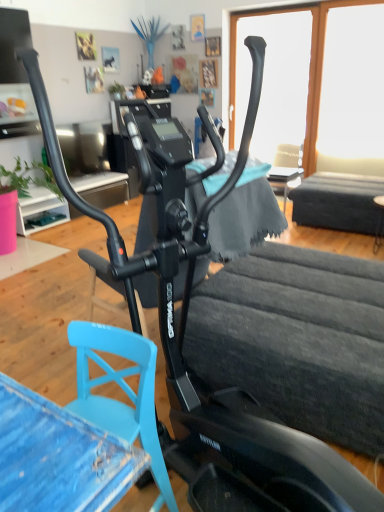
Describe the element at coordinates (352, 92) in the screenshot. I see `transparent glass window at upper right, which is the first window screen in right-to-left order` at that location.

At what (x,y) coordinates should I click in order to perform the action: click on transparent glass window at upper right, the second window screen viewed from the left. Please return your answer as a coordinate pair (x, y). The height and width of the screenshot is (512, 384). Looking at the image, I should click on (352, 92).

You are a GUI agent. You are given a task and a screenshot of the screen. Output one action in this format:
    pyautogui.click(x=<x>, y=<y>)
    Task: Click on the blue painted wood swivel chair at lower left
    
    Given the screenshot: What is the action you would take?
    pyautogui.click(x=124, y=391)

Describe the element at coordinates (337, 202) in the screenshot. I see `smooth wooden table at right, the 1th table when ordered from back to front` at that location.

Based on the photo, in order to face smooth wooden table at right, positioned as the 2th table in front-to-back order, should I rotate leftwards or rightwards?

Turn right approximately 20.740 degrees to face it.

This screenshot has height=512, width=384. I want to click on black matte table at lower right, which is counted as the 1th table, starting from the front, so click(x=378, y=222).

The image size is (384, 512). Describe the element at coordinates (309, 65) in the screenshot. I see `transparent glass window at upper center, arranged as the 2th window screen when viewed from the right` at that location.

The width and height of the screenshot is (384, 512). In order to click on transparent glass window at upper right, the second window screen viewed from the left in this screenshot , I will do `click(352, 92)`.

Would you say transparent glass window at upper right, the second window screen viewed from the left, is inside or outside black matte table at lower right, which is counted as the 1th table, starting from the front?

transparent glass window at upper right, the second window screen viewed from the left, exists outside the volume of black matte table at lower right, which is counted as the 1th table, starting from the front.

Is transparent glass window at upper right, which is the first window screen in right-to-left order, not near black matte table at lower right, the second table from the back?

Yes, transparent glass window at upper right, which is the first window screen in right-to-left order, and black matte table at lower right, the second table from the back, are quite far apart.

Could you tell me if transparent glass window at upper right, which is the first window screen in right-to-left order, is facing black matte table at lower right, which is counted as the 1th table, starting from the front?

Yes, transparent glass window at upper right, which is the first window screen in right-to-left order, is turned towards black matte table at lower right, which is counted as the 1th table, starting from the front.

Could you measure the distance between transparent glass window at upper right, which is the first window screen in right-to-left order, and black matte table at lower right, which is counted as the 1th table, starting from the front?

A distance of 1.27 meters exists between transparent glass window at upper right, which is the first window screen in right-to-left order, and black matte table at lower right, which is counted as the 1th table, starting from the front.

Are transparent glass window at upper center, which appears as the first window screen when viewed from the left, and transparent glass window at upper right, the second window screen viewed from the left, beside each other?

transparent glass window at upper center, which appears as the first window screen when viewed from the left, and transparent glass window at upper right, the second window screen viewed from the left, are not in contact.

Is transparent glass window at upper center, which appears as the first window screen when viewed from the left, facing away from transparent glass window at upper right, which is the first window screen in right-to-left order?

No, transparent glass window at upper center, which appears as the first window screen when viewed from the left,'s orientation is not away from transparent glass window at upper right, which is the first window screen in right-to-left order.

Considering the sizes of objects transparent glass window at upper center, which appears as the first window screen when viewed from the left, and transparent glass window at upper right, which is the first window screen in right-to-left order, in the image provided, who is wider, transparent glass window at upper center, which appears as the first window screen when viewed from the left, or transparent glass window at upper right, which is the first window screen in right-to-left order,?

transparent glass window at upper right, which is the first window screen in right-to-left order.

Considering the relative sizes of transparent glass window at upper center, arranged as the 2th window screen when viewed from the right, and transparent glass window at upper right, which is the first window screen in right-to-left order, in the image provided, is transparent glass window at upper center, arranged as the 2th window screen when viewed from the right, smaller than transparent glass window at upper right, which is the first window screen in right-to-left order,?

No, transparent glass window at upper center, arranged as the 2th window screen when viewed from the right, is not smaller than transparent glass window at upper right, which is the first window screen in right-to-left order.

Locate an element on the screen. fabric in front of the transparent glass window at upper right, which is the first window screen in right-to-left order is located at coordinates (245, 215).

Which object is wider, soft blue cloth at center or transparent glass window at upper right, the second window screen viewed from the left?

With larger width is soft blue cloth at center.

Do you think soft blue cloth at center is within transparent glass window at upper right, the second window screen viewed from the left, or outside of it?

soft blue cloth at center is not inside transparent glass window at upper right, the second window screen viewed from the left, it's outside.

Can you confirm if soft blue cloth at center is bigger than transparent glass window at upper right, which is the first window screen in right-to-left order?

No, soft blue cloth at center is not bigger than transparent glass window at upper right, which is the first window screen in right-to-left order.

Can you see blue painted wood swivel chair at lower left touching smooth wooden table at right, positioned as the 2th table in front-to-back order?

There is a gap between blue painted wood swivel chair at lower left and smooth wooden table at right, positioned as the 2th table in front-to-back order.

Looking at this image, is blue painted wood swivel chair at lower left inside or outside of smooth wooden table at right, positioned as the 2th table in front-to-back order?

blue painted wood swivel chair at lower left is not inside smooth wooden table at right, positioned as the 2th table in front-to-back order, it's outside.

Which of these two, blue painted wood swivel chair at lower left or smooth wooden table at right, positioned as the 2th table in front-to-back order, is thinner?

blue painted wood swivel chair at lower left.

Is transparent glass window at upper right, the second window screen viewed from the left, situated inside transparent glass window at upper center, which appears as the first window screen when viewed from the left, or outside?

transparent glass window at upper right, the second window screen viewed from the left, is not enclosed by transparent glass window at upper center, which appears as the first window screen when viewed from the left.

Is transparent glass window at upper right, the second window screen viewed from the left, further to the viewer compared to transparent glass window at upper center, which appears as the first window screen when viewed from the left?

No, transparent glass window at upper right, the second window screen viewed from the left, is in front of transparent glass window at upper center, which appears as the first window screen when viewed from the left.

This screenshot has width=384, height=512. In the image, there is a transparent glass window at upper right, the second window screen viewed from the left. Find the location of `window screen below it (from a real-world perspective)`. window screen below it (from a real-world perspective) is located at coordinates (309, 65).

Does transparent glass window at upper right, the second window screen viewed from the left, have a lesser height compared to transparent glass window at upper center, which appears as the first window screen when viewed from the left?

Indeed, transparent glass window at upper right, the second window screen viewed from the left, has a lesser height compared to transparent glass window at upper center, which appears as the first window screen when viewed from the left.

Is transparent glass window at upper center, arranged as the 2th window screen when viewed from the right, facing towards blue painted wood swivel chair at lower left?

Yes, transparent glass window at upper center, arranged as the 2th window screen when viewed from the right, is turned towards blue painted wood swivel chair at lower left.

Can blue painted wood swivel chair at lower left be found inside transparent glass window at upper center, arranged as the 2th window screen when viewed from the right?

No, blue painted wood swivel chair at lower left is located outside of transparent glass window at upper center, arranged as the 2th window screen when viewed from the right.

Considering the relative sizes of transparent glass window at upper center, which appears as the first window screen when viewed from the left, and blue painted wood swivel chair at lower left in the image provided, is transparent glass window at upper center, which appears as the first window screen when viewed from the left, wider than blue painted wood swivel chair at lower left?

No.

From the image's perspective, does transparent glass window at upper center, arranged as the 2th window screen when viewed from the right, appear higher than blue painted wood swivel chair at lower left?

Indeed, from the image's perspective, transparent glass window at upper center, arranged as the 2th window screen when viewed from the right, is shown above blue painted wood swivel chair at lower left.

Image resolution: width=384 pixels, height=512 pixels. In order to click on window screen that is the 2nd one when counting upward from the blue painted wood swivel chair at lower left (from the image's perspective) in this screenshot , I will do `click(309, 65)`.

From the image's perspective, relative to transparent glass window at upper center, arranged as the 2th window screen when viewed from the right, is blue painted wood swivel chair at lower left above or below?

blue painted wood swivel chair at lower left is situated lower than transparent glass window at upper center, arranged as the 2th window screen when viewed from the right, in the image.

Between blue painted wood swivel chair at lower left and transparent glass window at upper center, which appears as the first window screen when viewed from the left, which one has smaller size?

blue painted wood swivel chair at lower left is smaller.

This screenshot has height=512, width=384. What are the coordinates of `window screen that is on the right side of black matte table at lower right, which is counted as the 1th table, starting from the front` in the screenshot? It's located at (352, 92).

The width and height of the screenshot is (384, 512). I want to click on window screen above the transparent glass window at upper center, arranged as the 2th window screen when viewed from the right (from a real-world perspective), so coord(352,92).

Based on their spatial positions, is smooth wooden table at right, positioned as the 2th table in front-to-back order, or transparent glass window at upper right, which is the first window screen in right-to-left order, closer to blue painted wood swivel chair at lower left?

smooth wooden table at right, positioned as the 2th table in front-to-back order.

Based on the photo, when comparing their distances from black matte table at lower right, which is counted as the 1th table, starting from the front, does transparent glass window at upper right, which is the first window screen in right-to-left order, or transparent glass window at upper center, arranged as the 2th window screen when viewed from the right, seem further?

Among the two, transparent glass window at upper center, arranged as the 2th window screen when viewed from the right, is located further to black matte table at lower right, which is counted as the 1th table, starting from the front.

Which object lies further to the anchor point transparent glass window at upper center, arranged as the 2th window screen when viewed from the right, smooth wooden table at right, the 1th table when ordered from back to front, or soft blue cloth at center?

soft blue cloth at center.

Estimate the real-world distances between objects in this image. Which object is closer to black matte table at lower right, the second table from the back, soft blue cloth at center or smooth wooden table at right, positioned as the 2th table in front-to-back order?

smooth wooden table at right, positioned as the 2th table in front-to-back order, is closer to black matte table at lower right, the second table from the back.

Looking at the image, which one is located closer to soft blue cloth at center, transparent glass window at upper right, which is the first window screen in right-to-left order, or smooth wooden table at right, the 1th table when ordered from back to front?

smooth wooden table at right, the 1th table when ordered from back to front, lies closer to soft blue cloth at center than the other object.

Which object lies nearer to the anchor point soft blue cloth at center, transparent glass window at upper center, which appears as the first window screen when viewed from the left, or blue painted wood swivel chair at lower left?

blue painted wood swivel chair at lower left.

Which object lies further to the anchor point smooth wooden table at right, positioned as the 2th table in front-to-back order, black matte table at lower right, which is counted as the 1th table, starting from the front, or transparent glass window at upper center, arranged as the 2th window screen when viewed from the right?

transparent glass window at upper center, arranged as the 2th window screen when viewed from the right, is further to smooth wooden table at right, positioned as the 2th table in front-to-back order.

Based on their spatial positions, is smooth wooden table at right, the 1th table when ordered from back to front, or black matte table at lower right, the second table from the back, further from transparent glass window at upper right, the second window screen viewed from the left?

black matte table at lower right, the second table from the back, lies further to transparent glass window at upper right, the second window screen viewed from the left, than the other object.

Identify the location of window screen between transparent glass window at upper center, arranged as the 2th window screen when viewed from the right, and black matte table at lower right, which is counted as the 1th table, starting from the front, in the vertical direction. The width and height of the screenshot is (384, 512). (352, 92).

Where is `fabric positioned between blue painted wood swivel chair at lower left and smooth wooden table at right, the 1th table when ordered from back to front, from near to far`? fabric positioned between blue painted wood swivel chair at lower left and smooth wooden table at right, the 1th table when ordered from back to front, from near to far is located at coordinates (245, 215).

I want to click on fabric located between blue painted wood swivel chair at lower left and transparent glass window at upper center, which appears as the first window screen when viewed from the left, in the depth direction, so click(x=245, y=215).

The height and width of the screenshot is (512, 384). I want to click on fabric between blue painted wood swivel chair at lower left and transparent glass window at upper right, which is the first window screen in right-to-left order, along the z-axis, so click(245, 215).